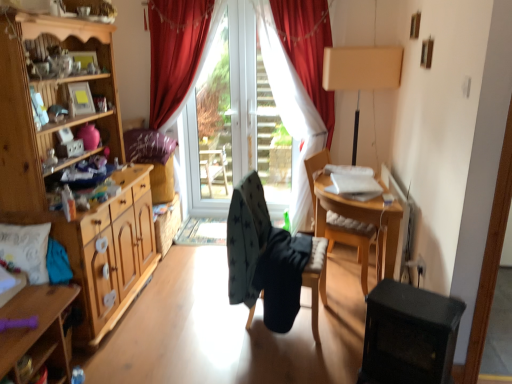
You are a GUI agent. You are given a task and a screenshot of the screen. Output one action in this format:
    pyautogui.click(x=<x>, y=<y>)
    Task: Click on the free location to the left of dark gray fabric chair at center, acting as the 2th chair starting from the right
    Image resolution: width=512 pixels, height=384 pixels.
    Given the screenshot: What is the action you would take?
    pyautogui.click(x=204, y=320)